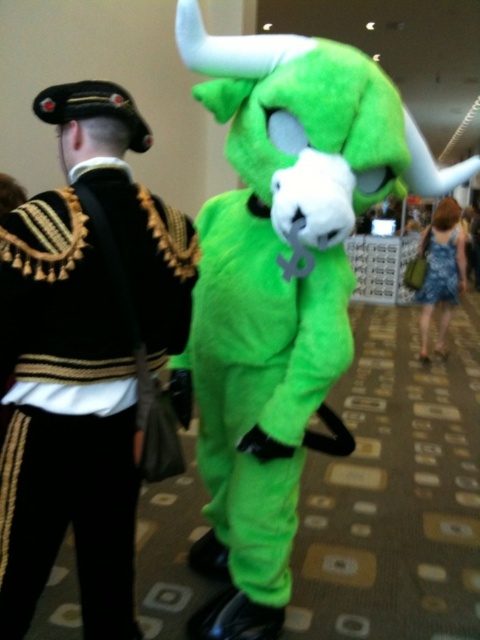
You are standing at the origin of a coordinate system placed at the bottom left corner of the image. The coordinates are normalized between 0 and 1. A point at (278, 285) is marked. Which object does this point correspond to?

The point at (278, 285) corresponds to the green fuzzy costume at center.

You are attending a costume party and need to choose between the blue denim dress at lower right and the blue fabric dress at center. Which dress has a wider silhouette?

The blue denim dress at lower right has a wider silhouette than the blue fabric dress at center.